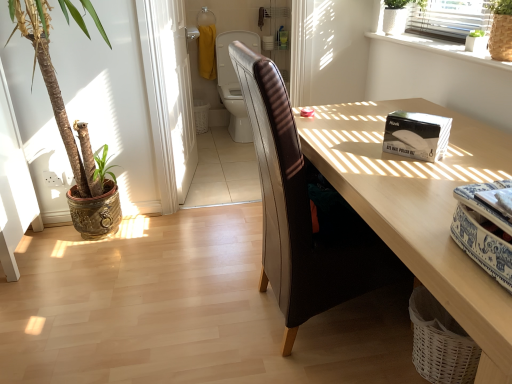
The image size is (512, 384). In order to click on free spot in front of white glossy nail polish kit at upper right in this screenshot , I will do `click(423, 173)`.